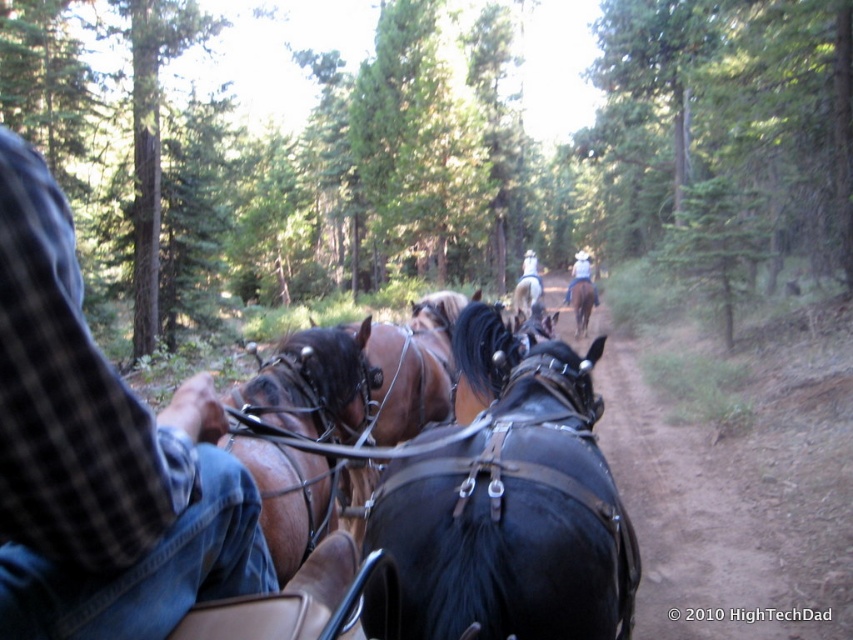
Consider the image. Can you confirm if black leather horse at center is bigger than black glossy horse at center?

Yes.

Consider the image. Measure the distance between point (610, 560) and camera.

A distance of 1.96 meters exists between point (610, 560) and camera.

Measure the distance between point (558, 413) and camera.

A distance of 8.82 feet exists between point (558, 413) and camera.

The height and width of the screenshot is (640, 853). I want to click on black leather horse at center, so click(514, 516).

Is brown leather horse at center positioned in front of white cowboy hat at upper center?

That is True.

Does brown leather horse at center have a lesser height compared to white cowboy hat at upper center?

Indeed, brown leather horse at center has a lesser height compared to white cowboy hat at upper center.

Does point (582, 296) come closer to viewer compared to point (582, 269)?

Yes, point (582, 296) is closer to viewer.

Locate an element on the screen. brown leather horse at center is located at coordinates (582, 304).

Which of these two, black leather horse at center or brown glossy horse at center, stands shorter?

black leather horse at center

Identify the location of black leather horse at center. This screenshot has height=640, width=853. (514, 516).

I want to click on black leather horse at center, so click(x=514, y=516).